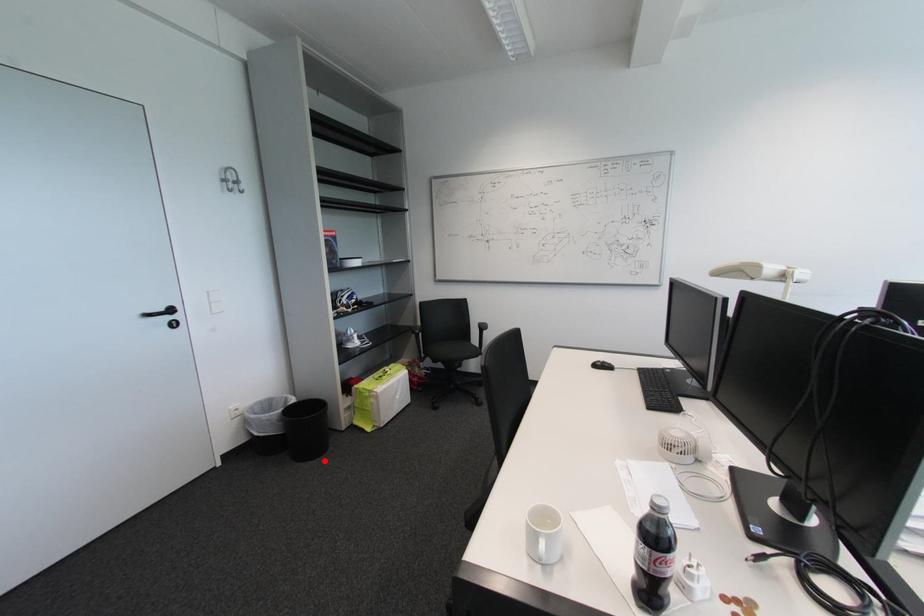
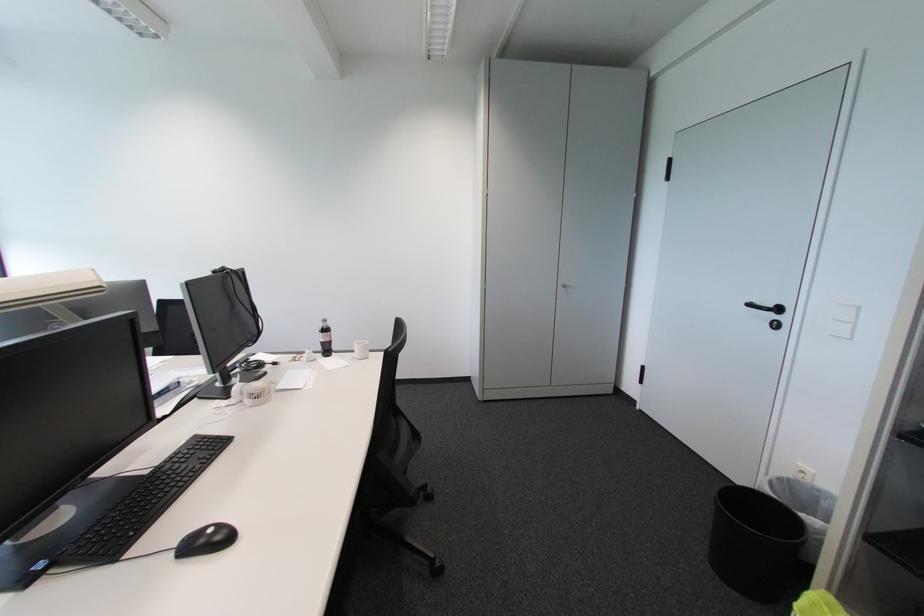
Locate, in the second image, the point that corresponds to the highlighted location in the first image.

(714, 565)